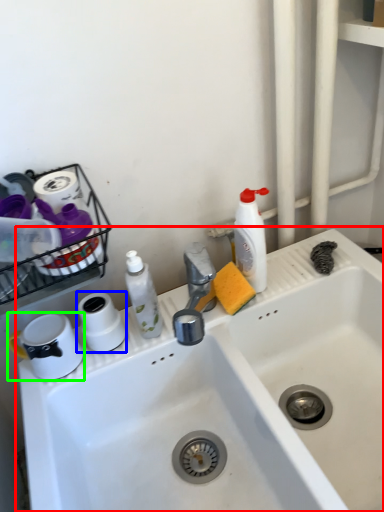
Question: Which object is the farthest from sink (highlighted by a red box)? Choose among these: toilet paper (highlighted by a blue box) or appliance (highlighted by a green box).

Choices:
 (A) toilet paper
 (B) appliance

Answer: (B)